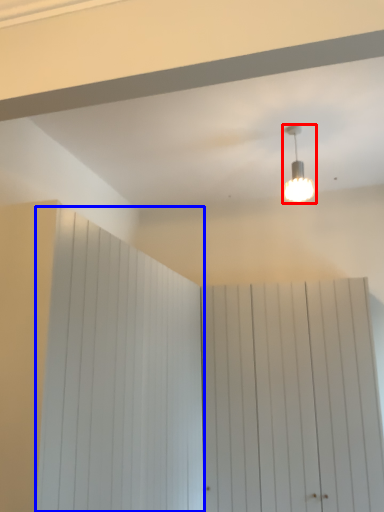
Question: Which object appears closest to the camera in this image, lamp (highlighted by a red box) or barn door (highlighted by a blue box)?

Choices:
 (A) lamp
 (B) barn door

Answer: (B)